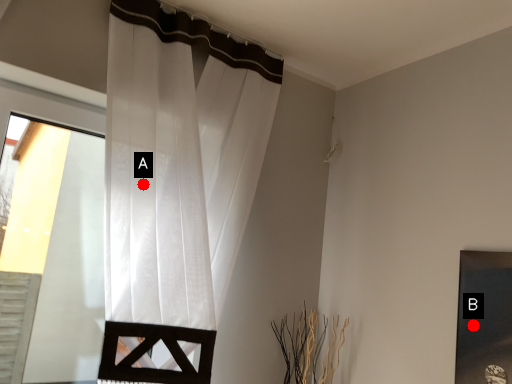
Question: Two points are circled on the image, labeled by A and B beside each circle. Among these points, which one is farthest from the camera?

Choices:
 (A) A is further
 (B) B is further

Answer: (A)